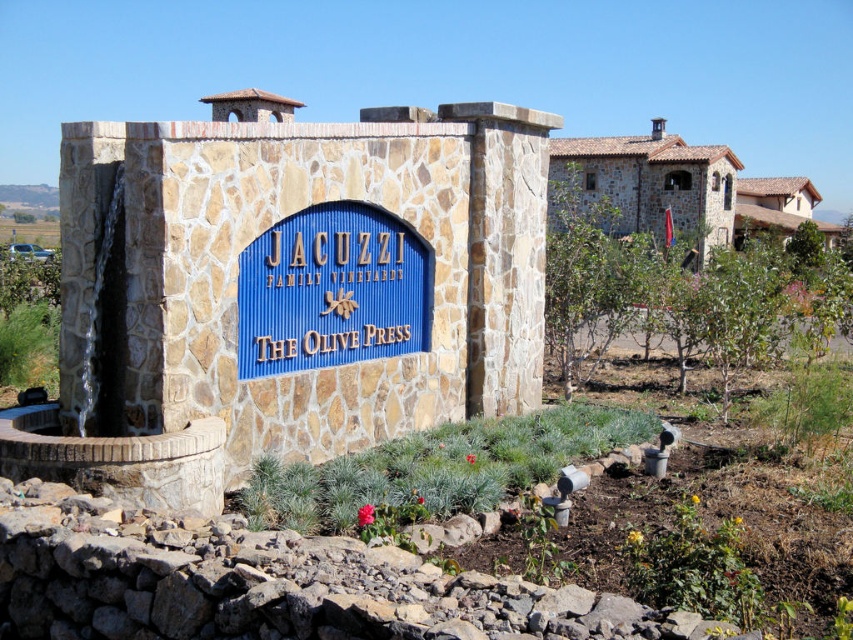
You are standing in front of the blue stone sign at center. You want to take a photo of it with your smartphone, which has a maximum focus distance of 5 meters. Will you be able to focus on the sign?

The blue stone sign at center is 7.49 meters from camera, which is beyond the smartphone camera maximum focus distance of 5 meters. So you will not be able to focus on the sign.